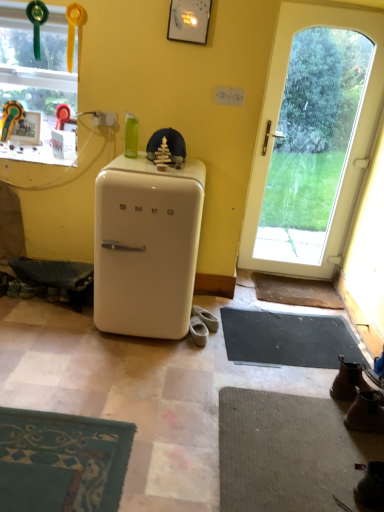
Locate an element on the screen. Image resolution: width=384 pixels, height=512 pixels. free location in front of white glass door at right is located at coordinates (292, 293).